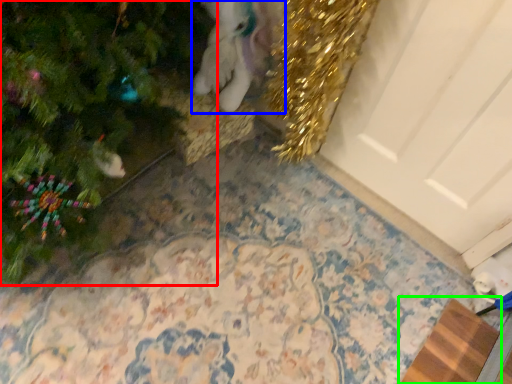
Question: Which object is positioned farthest from christmas tree (highlighted by a red box)? Select from animal (highlighted by a blue box) and doormat (highlighted by a green box).

Choices:
 (A) animal
 (B) doormat

Answer: (B)